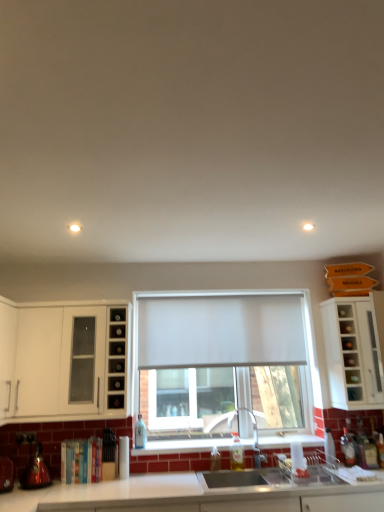
Question: Are shiny metallic kettle at lower left, the second appliance viewed from the left, and white glossy countertop at lower center making contact?

Choices:
 (A) yes
 (B) no

Answer: (B)

Question: Are shiny metallic kettle at lower left, the second appliance viewed from the left, and white glossy countertop at lower center far apart?

Choices:
 (A) yes
 (B) no

Answer: (B)

Question: Does shiny metallic kettle at lower left, the second appliance viewed from the left, appear on the right side of white glossy countertop at lower center?

Choices:
 (A) yes
 (B) no

Answer: (B)

Question: Is shiny metallic kettle at lower left, positioned as the 1th appliance in right-to-left order, looking in the opposite direction of white glossy countertop at lower center?

Choices:
 (A) yes
 (B) no

Answer: (B)

Question: Does shiny metallic kettle at lower left, the second appliance viewed from the left, have a lesser height compared to white glossy countertop at lower center?

Choices:
 (A) yes
 (B) no

Answer: (A)

Question: From the image's perspective, is matte glass shelf at lower left above or below matte stainless steel sink at lower center?

Choices:
 (A) above
 (B) below

Answer: (A)

Question: Is matte glass shelf at lower left inside the boundaries of matte stainless steel sink at lower center, or outside?

Choices:
 (A) outside
 (B) inside

Answer: (A)

Question: Based on their sizes in the image, would you say matte glass shelf at lower left is bigger or smaller than matte stainless steel sink at lower center?

Choices:
 (A) big
 (B) small

Answer: (B)

Question: In terms of width, does matte glass shelf at lower left look wider or thinner when compared to matte stainless steel sink at lower center?

Choices:
 (A) wide
 (B) thin

Answer: (B)

Question: Considering their positions, is translucent glass bottle at lower right, which appears as the sixth bottle when viewed from the left, located in front of or behind white matte curtain at center?

Choices:
 (A) front
 (B) behind

Answer: (A)

Question: From the image's perspective, relative to white matte curtain at center, is translucent glass bottle at lower right, which appears as the sixth bottle when viewed from the left, above or below?

Choices:
 (A) above
 (B) below

Answer: (B)

Question: Is translucent glass bottle at lower right, arranged as the 1th bottle when viewed from the right, inside or outside of white matte curtain at center?

Choices:
 (A) inside
 (B) outside

Answer: (B)

Question: Is point (365, 459) positioned closer to the camera than point (299, 311)?

Choices:
 (A) closer
 (B) farther

Answer: (A)

Question: From their relative heights in the image, would you say white matte curtain at center is taller or shorter than clear glass bottle at lower right, which is the 3th bottle from right to left?

Choices:
 (A) tall
 (B) short

Answer: (A)

Question: Considering the relative positions of white matte curtain at center and clear glass bottle at lower right, the fourth bottle positioned from the left, in the image provided, is white matte curtain at center to the left or to the right of clear glass bottle at lower right, the fourth bottle positioned from the left,?

Choices:
 (A) left
 (B) right

Answer: (A)